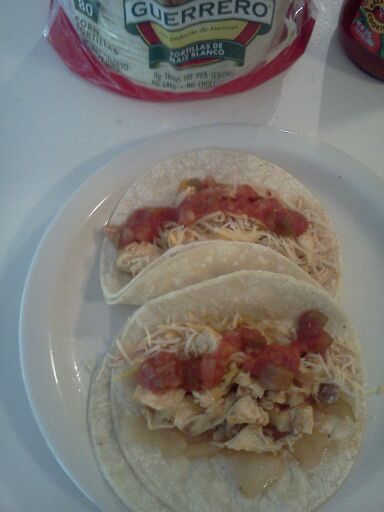
Where is `plate`? Image resolution: width=384 pixels, height=512 pixels. plate is located at coordinates (86, 326).